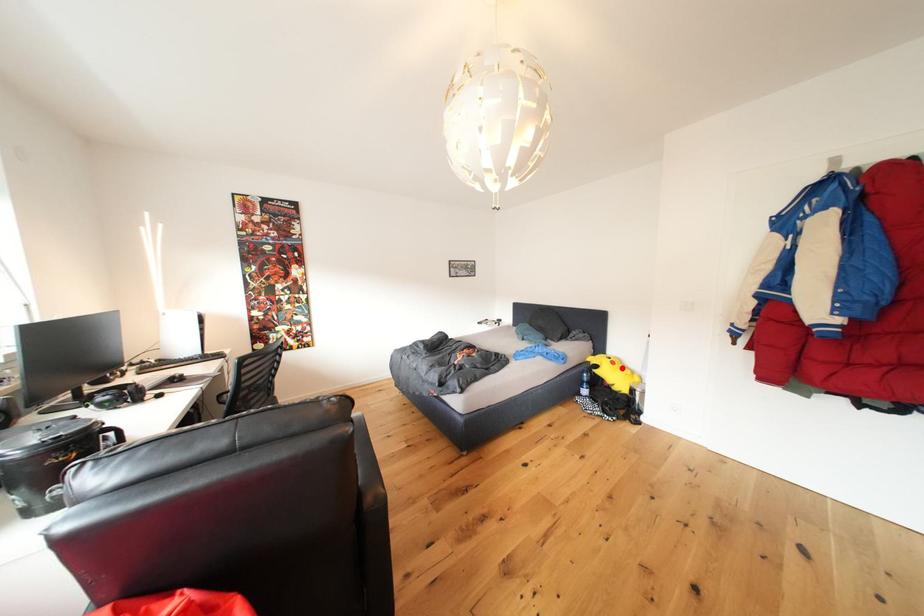
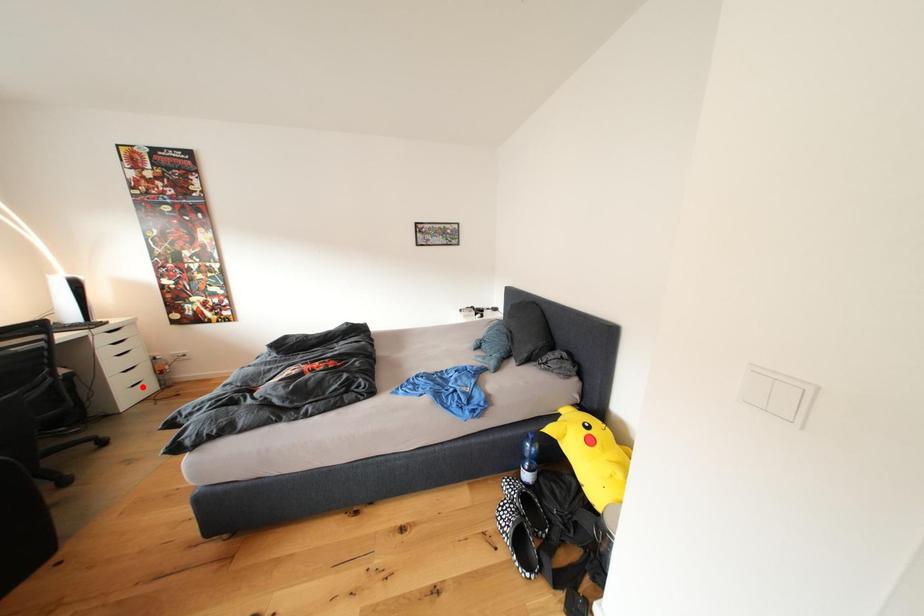
I am providing you with two images of the same scene from different viewpoints. A red point is marked on the first image and another point is marked on the second image. Is the marked point in image1 the same physical position as the marked point in image2?

No